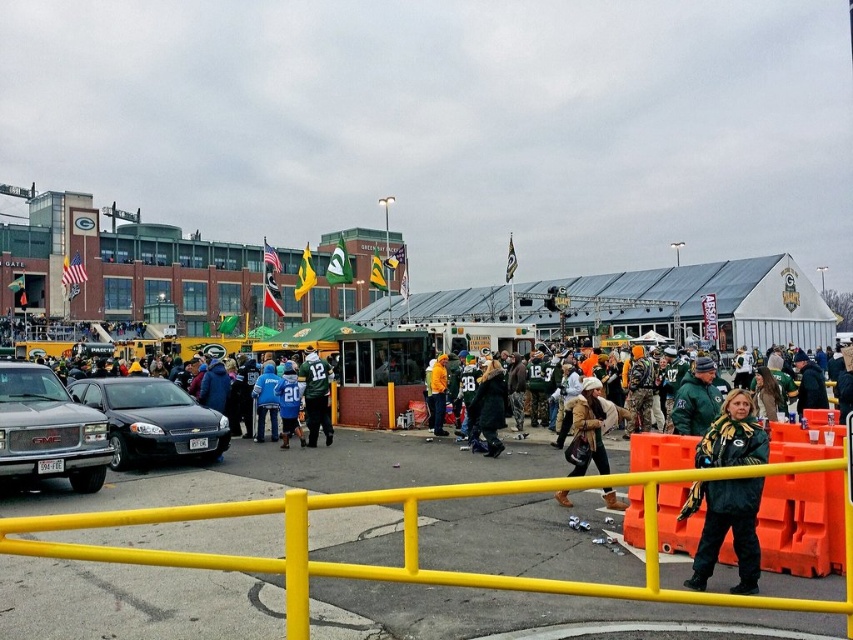
You are a photographer standing at the edge of the sports stadium. You want to capture a photo of the green wool scarf at center without the orange foam barrier at lower right blocking the view. Is this possible based on their positions?

The orange foam barrier at lower right is positioned under the green wool scarf at center, so the scarf is above the barrier. Therefore, the photographer can capture the green wool scarf at center without the orange foam barrier at lower right blocking the view since it is below the scarf.

You are standing at the yellow railing in the foreground and want to locate the brown leather jacket at center. Based on its 2D coordinates, in which direction should you look to find it?

The brown leather jacket at center is located at coordinates point (592, 426). Since the coordinate system typically places the origin at the bottom left corner, the jacket is positioned towards the upper right direction from the yellow railing.